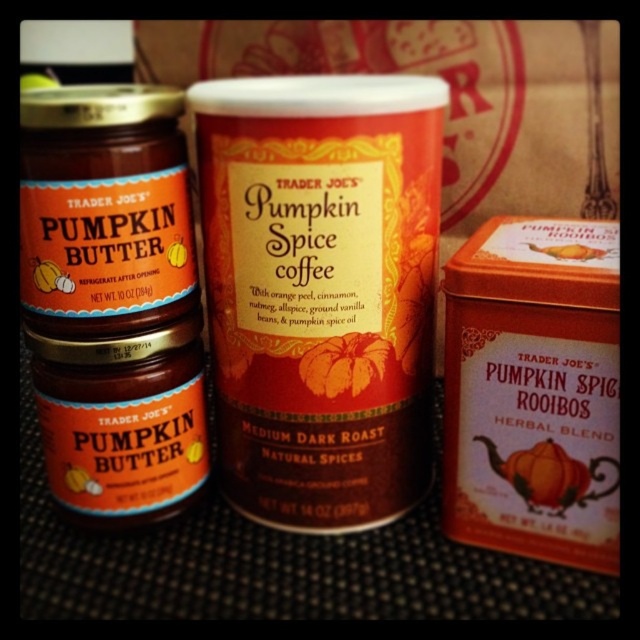
You are organizing a Thanksgiving spread and have limited space on your table. You need to place the matte orange tin at center right and the orange matte pumpkin spice rooibos herbal blend at center. Which item will require more space due to its size?

The matte orange tin at center right requires more space because it has a larger size compared to the orange matte pumpkin spice rooibos herbal blend at center.

You are trying to place the matte orange tin at center right and the orange matte pumpkin spice rooibos herbal blend at center onto a shelf that can only hold items up to 12 inches in width. Based on their widths, can both items fit side by side on the shelf?

The matte orange tin at center right might be wider than the orange matte pumpkin spice rooibos herbal blend at center. However, since the exact width of both items isn t provided, we cannot definitively determine if their combined width would exceed 12 inches. More information is needed to confirm.

You are trying to reach the matte orange tin at center right to grab it, but there is an orange matte pumpkin spice rooibos herbal blend at center in the way. Can you move the herbal blend to access the tin?

The orange matte pumpkin spice rooibos herbal blend at center is behind the matte orange tin at center right, so you can access the matte orange tin at center right without moving the herbal blend.